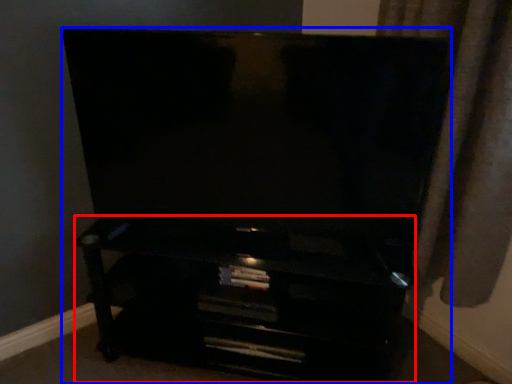
Question: Which object appears farthest to the camera in this image, entertainment center (highlighted by a red box) or furniture (highlighted by a blue box)?

Choices:
 (A) entertainment center
 (B) furniture

Answer: (A)